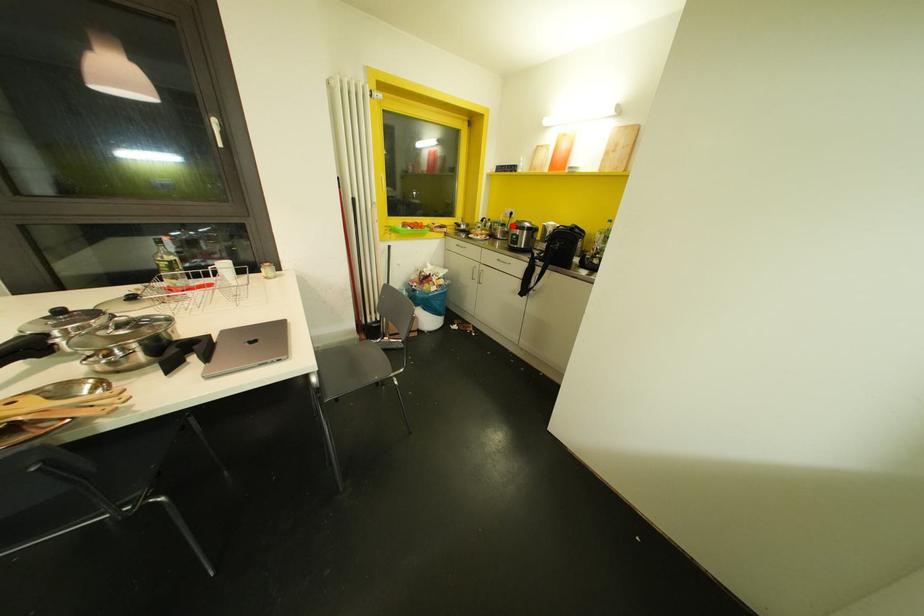
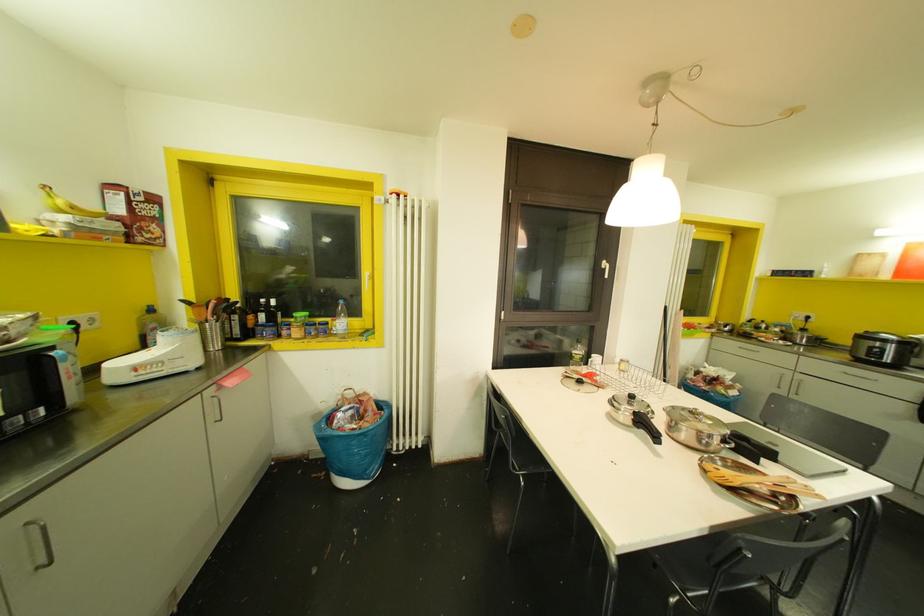
Find the pixel in the second image that matches the highlighted location in the first image.

(861, 336)